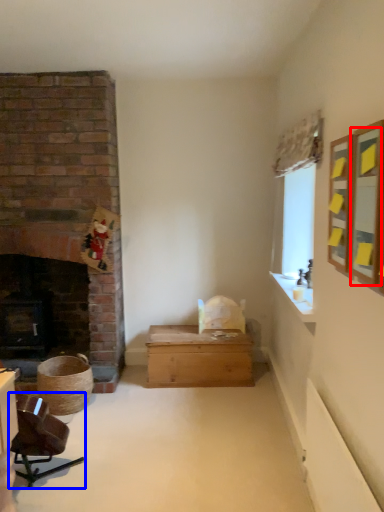
Question: Among these objects, which one is nearest to the camera, mirror (highlighted by a red box) or chair (highlighted by a blue box)?

Choices:
 (A) mirror
 (B) chair

Answer: (A)